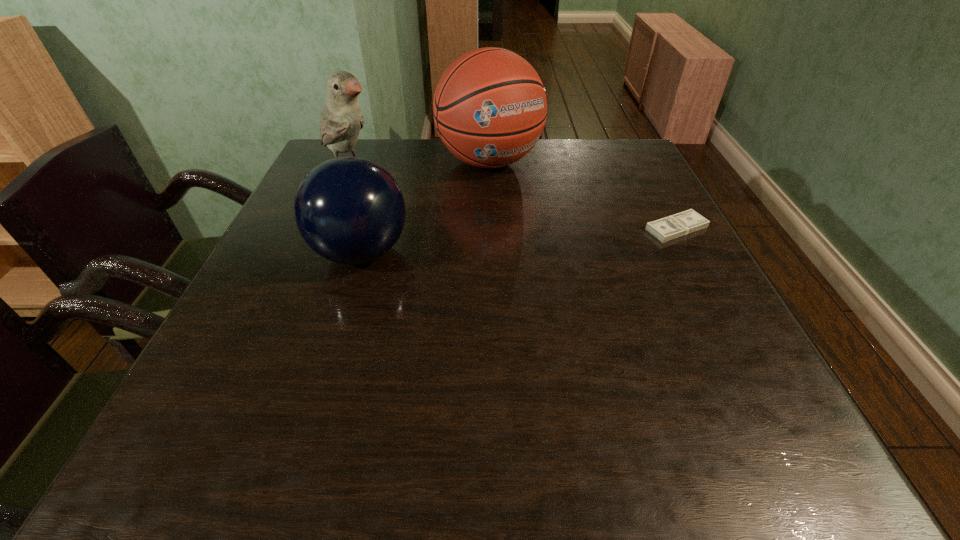
Find the location of a particular element. This screenshot has height=540, width=960. blank region between the money and the basketball is located at coordinates (583, 195).

The image size is (960, 540). Identify the location of unoccupied area between the third tallest object and the basketball. (425, 207).

Identify the location of vacant area between the second object from right to left and the bird. (420, 165).

Find the location of a particular element. vacant space that's between the bowling ball and the third object from left to right is located at coordinates (425, 207).

You are a GUI agent. You are given a task and a screenshot of the screen. Output one action in this format:
    pyautogui.click(x=<x>, y=<y>)
    Task: Click on the closest object to the bowling ball
    Image resolution: width=960 pixels, height=540 pixels.
    Given the screenshot: What is the action you would take?
    pyautogui.click(x=490, y=106)

Locate which object ranks second in proximity to the rightmost object. Please provide its 2D coordinates. Your answer should be formatted as a tuple, i.e. [(x, y)], where the tuple contains the x and y coordinates of a point satisfying the conditions above.

[(349, 210)]

Where is `free spot that satisfies the following two spatial constraints: 1. on the front side of the shortest object; 2. on the left side of the third object from left to right`? The height and width of the screenshot is (540, 960). free spot that satisfies the following two spatial constraints: 1. on the front side of the shortest object; 2. on the left side of the third object from left to right is located at coordinates (492, 228).